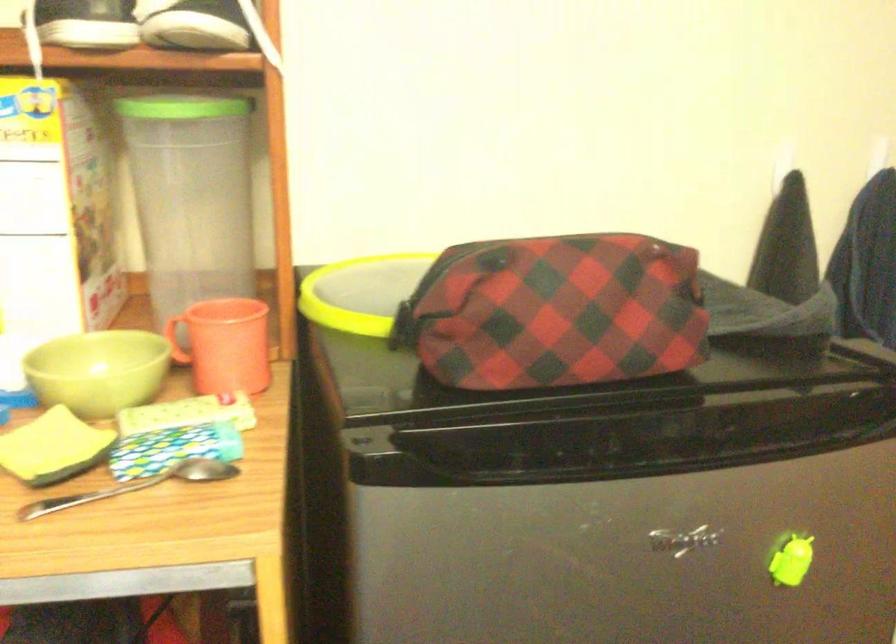
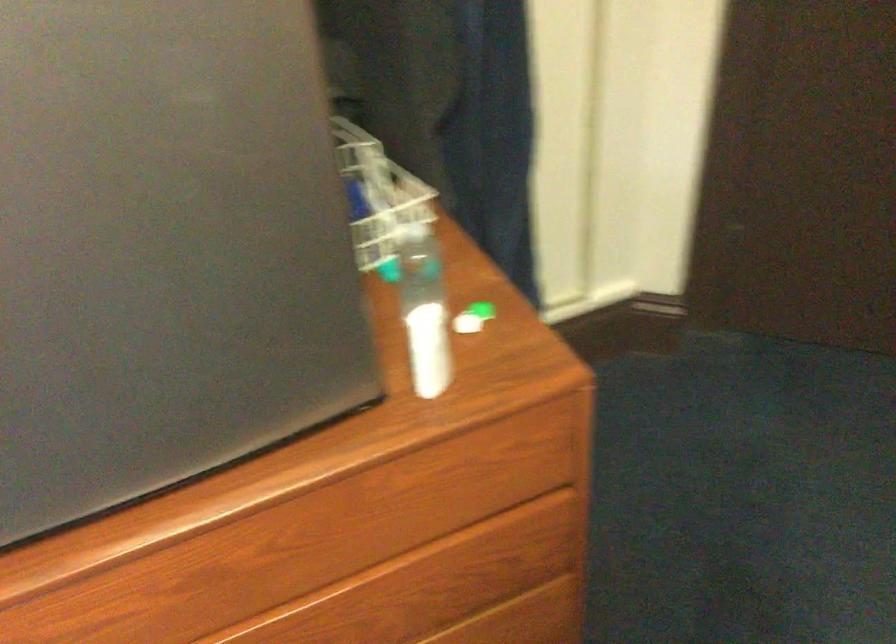
Question: The first image is from the beginning of the video and the second image is from the end. How did the camera likely rotate when shooting the video?

Choices:
 (A) Left
 (B) Right
 (C) Up
 (D) Down

Answer: (D)